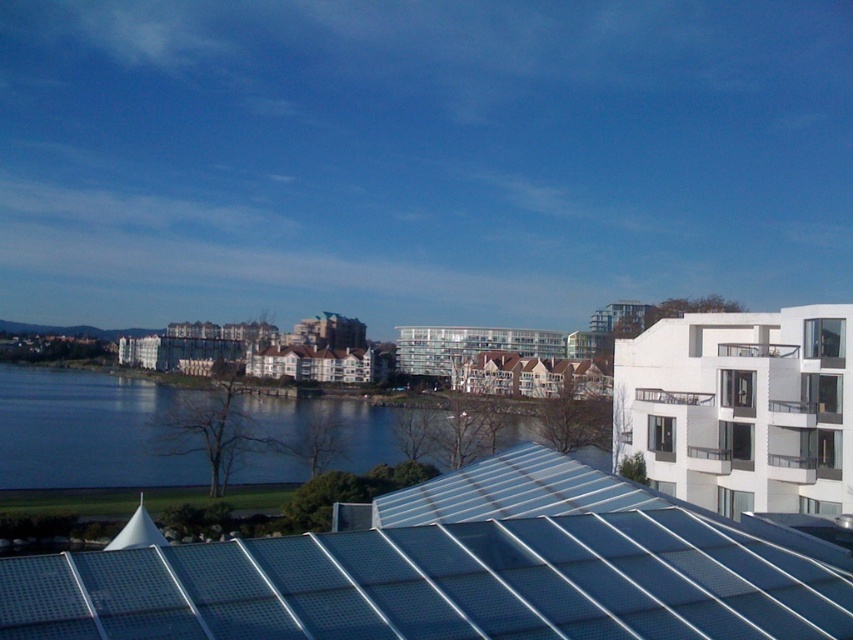
You are a photographer standing on the metallic roof in the foreground. You want to capture a photo of the white glass balcony at upper right and the blue water at center. Which object should you frame first in your camera viewfinder to ensure both are included in the shot?

The blue water at center should be framed first since it is positioned to the left of the white glass balcony at upper right, so by centering the blue water and adjusting the viewfinder to include the balcony to its right, both objects will be captured in the frame.

You are an architect designing a new building and want to incorporate elements from this scene. If you need to choose between replicating the metallic silver roof at center or the white glass balcony at upper right based on their widths, which one should you choose if you have limited space?

You should choose to replicate the white glass balcony at upper right because the metallic silver roof at center is wider than the white glass balcony at upper right, so the balcony would require less space.